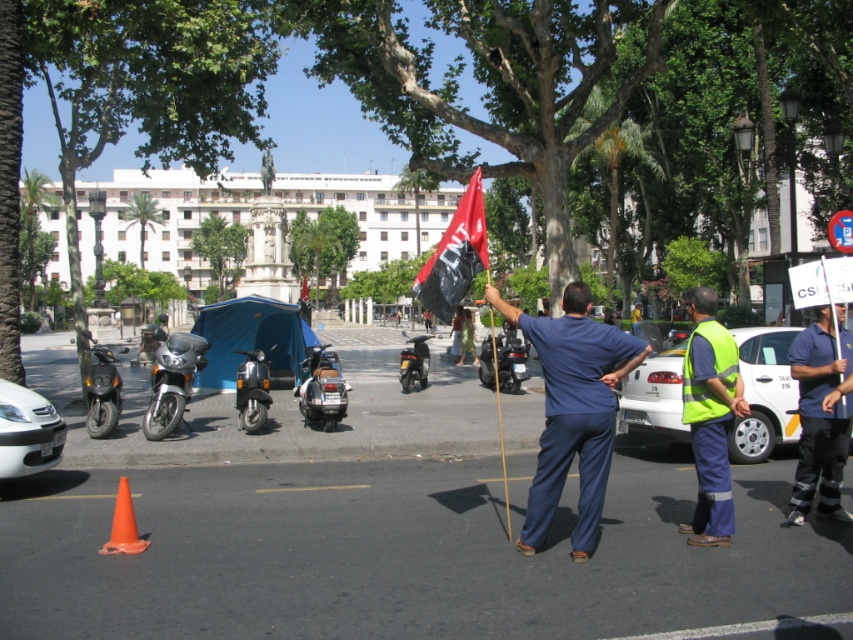
You are a pedestrian trying to cross the square. You see the blue fabric pants at center and the metallic silver motorcycle at center. Which object takes up more space horizontally?

The metallic silver motorcycle at center takes up more space horizontally since the blue fabric pants at center has a lesser width compared to it.

You are a pedestrian standing in the public square and see the blue fabric pants at center and the metallic silver motorcycle at center. Which object is closer to you?

The blue fabric pants at center is closer because it is in front of the metallic silver motorcycle at center.

You are a photographer setting up a tripod in the middle of the square. You want to ensure both the blue fabric pants at center and the metallic silver motorcycle at center are in the frame. Which object should you position closer to the camera to ensure both are fully visible?

The blue fabric pants at center is not as tall as the metallic silver motorcycle at center, so you should position the tripod closer to the blue fabric pants at center to ensure both are fully visible in the frame.